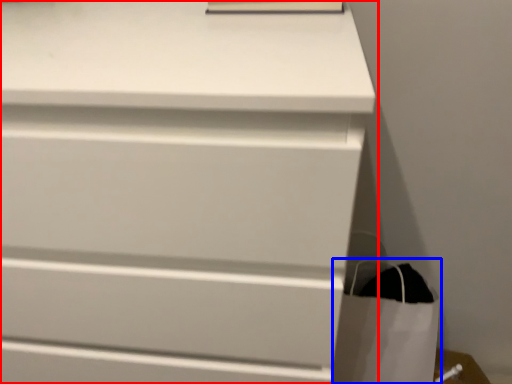
Question: Which object appears closest to the camera in this image, chest of drawers (highlighted by a red box) or shopping bag (highlighted by a blue box)?

Choices:
 (A) chest of drawers
 (B) shopping bag

Answer: (A)